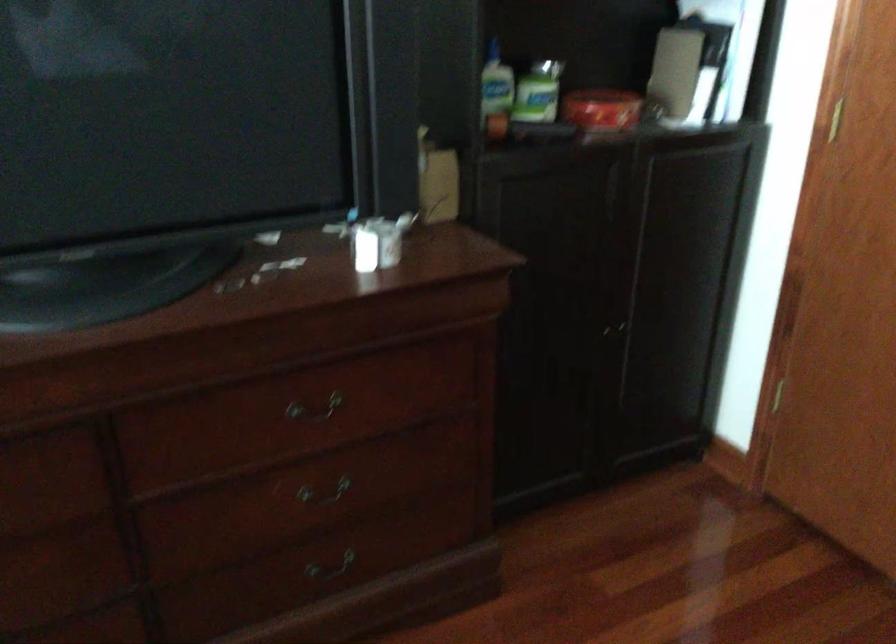
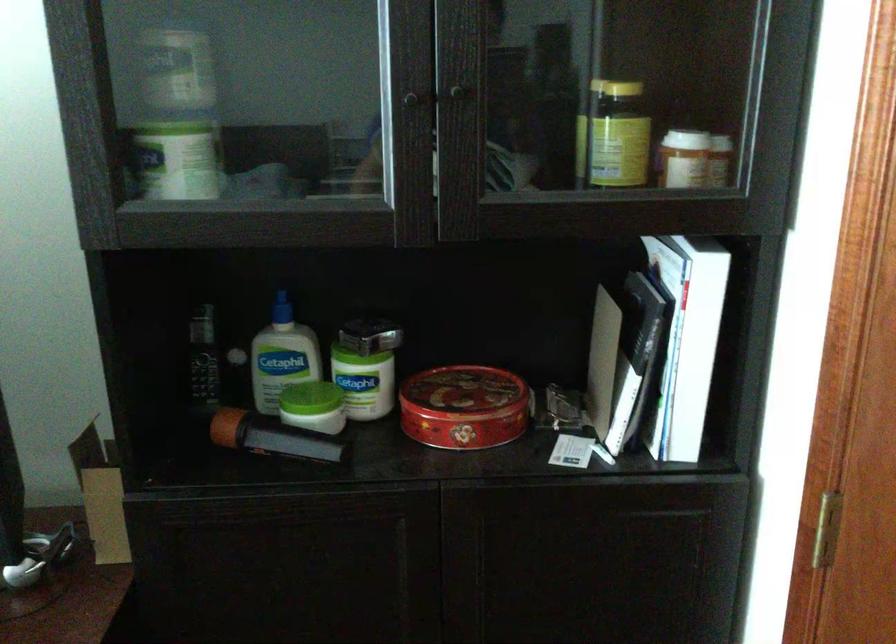
Find the pixel in the second image that matches pixel 604 97 in the first image.

(462, 393)